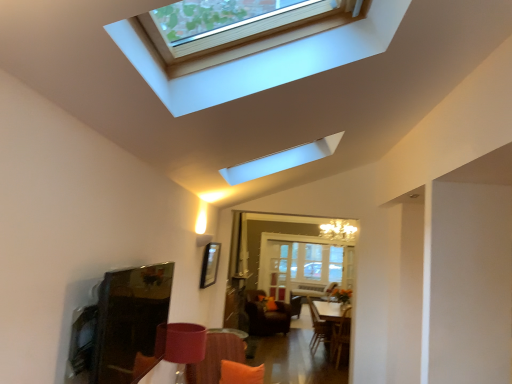
Question: Is clear glass door at center smaller than velvet orange armchair at lower center?

Choices:
 (A) yes
 (B) no

Answer: (B)

Question: From the image's perspective, is clear glass door at center on velvet orange armchair at lower center?

Choices:
 (A) yes
 (B) no

Answer: (A)

Question: Is clear glass door at center turned away from velvet orange armchair at lower center?

Choices:
 (A) yes
 (B) no

Answer: (B)

Question: Is clear glass door at center at the left side of velvet orange armchair at lower center?

Choices:
 (A) yes
 (B) no

Answer: (A)

Question: Does clear glass door at center contain velvet orange armchair at lower center?

Choices:
 (A) no
 (B) yes

Answer: (A)

Question: From a real-world perspective, is clear glass door at center beneath velvet orange armchair at lower center?

Choices:
 (A) no
 (B) yes

Answer: (A)

Question: From a real-world perspective, is velvet brown swivel chair at center, which is counted as the 2th swivel chair, starting from the right, below orange fabric couch at lower center?

Choices:
 (A) yes
 (B) no

Answer: (A)

Question: Can we say velvet brown swivel chair at center, which is counted as the 2th swivel chair, starting from the right, lies outside orange fabric couch at lower center?

Choices:
 (A) no
 (B) yes

Answer: (B)

Question: Considering the relative sizes of velvet brown swivel chair at center, the 2th swivel chair when ordered from front to back, and orange fabric couch at lower center in the image provided, is velvet brown swivel chair at center, the 2th swivel chair when ordered from front to back, smaller than orange fabric couch at lower center?

Choices:
 (A) no
 (B) yes

Answer: (A)

Question: Considering the relative positions of velvet brown swivel chair at center, placed as the 1th swivel chair when sorted from back to front, and orange fabric couch at lower center in the image provided, is velvet brown swivel chair at center, placed as the 1th swivel chair when sorted from back to front, to the right of orange fabric couch at lower center from the viewer's perspective?

Choices:
 (A) yes
 (B) no

Answer: (A)

Question: Is velvet brown swivel chair at center, which is counted as the 2th swivel chair, starting from the right, to the left of orange fabric couch at lower center from the viewer's perspective?

Choices:
 (A) no
 (B) yes

Answer: (A)

Question: Is velvet brown swivel chair at center, placed as the first swivel chair when sorted from left to right, facing towards orange fabric couch at lower center?

Choices:
 (A) no
 (B) yes

Answer: (A)

Question: Considering the relative positions of clear glass door at center and matte white window at upper center in the image provided, is clear glass door at center to the right of matte white window at upper center from the viewer's perspective?

Choices:
 (A) yes
 (B) no

Answer: (A)